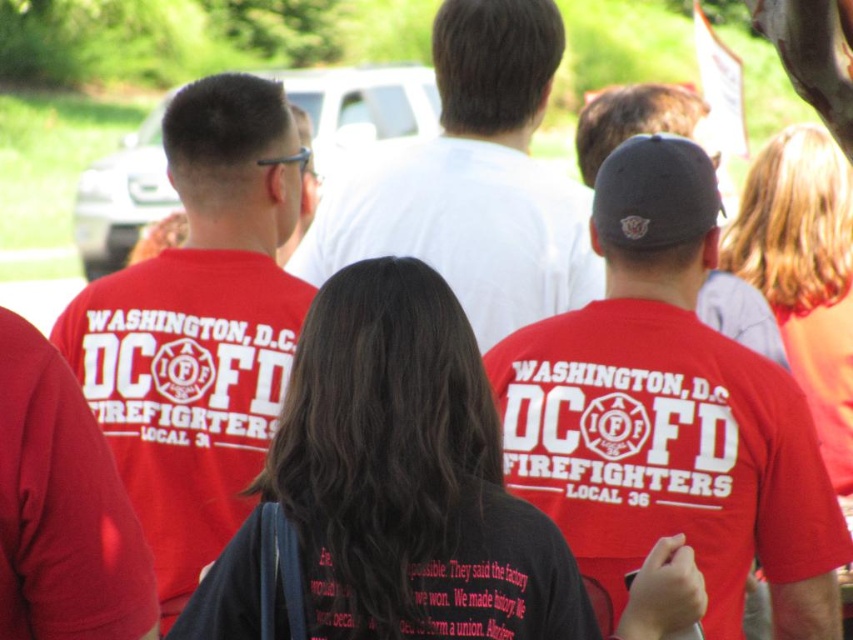
Question: Can you confirm if red matte t-shirt at center is smaller than matte red t-shirt at center?

Choices:
 (A) no
 (B) yes

Answer: (A)

Question: Can you confirm if red matte t-shirt at center is wider than matte red t-shirt at center?

Choices:
 (A) no
 (B) yes

Answer: (A)

Question: Based on their relative distances, which object is nearer to the matte red shirt at left?

Choices:
 (A) matte red shirt at center
 (B) red matte t-shirt at center
 (C) white cotton shirt at center

Answer: (A)

Question: Considering the real-world distances, which object is closest to the red matte t-shirt at center?

Choices:
 (A) matte red shirt at center
 (B) matte red t-shirt at center
 (C) white cotton shirt at center

Answer: (B)

Question: Does red matte t-shirt at center appear under matte red shirt at left?

Choices:
 (A) yes
 (B) no

Answer: (A)

Question: Which object is closer to the camera taking this photo?

Choices:
 (A) white cotton shirt at center
 (B) matte red t-shirt at center
 (C) matte red shirt at left

Answer: (B)